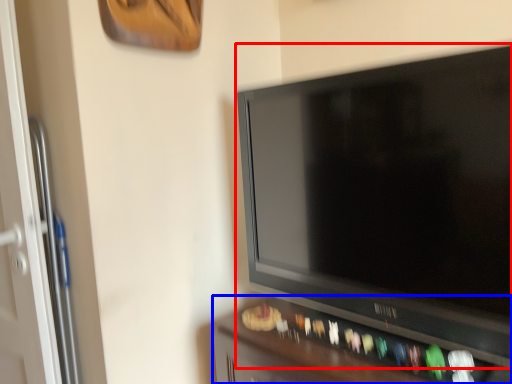
Question: Among these objects, which one is farthest to the camera, television (highlighted by a red box) or furniture (highlighted by a blue box)?

Choices:
 (A) television
 (B) furniture

Answer: (B)